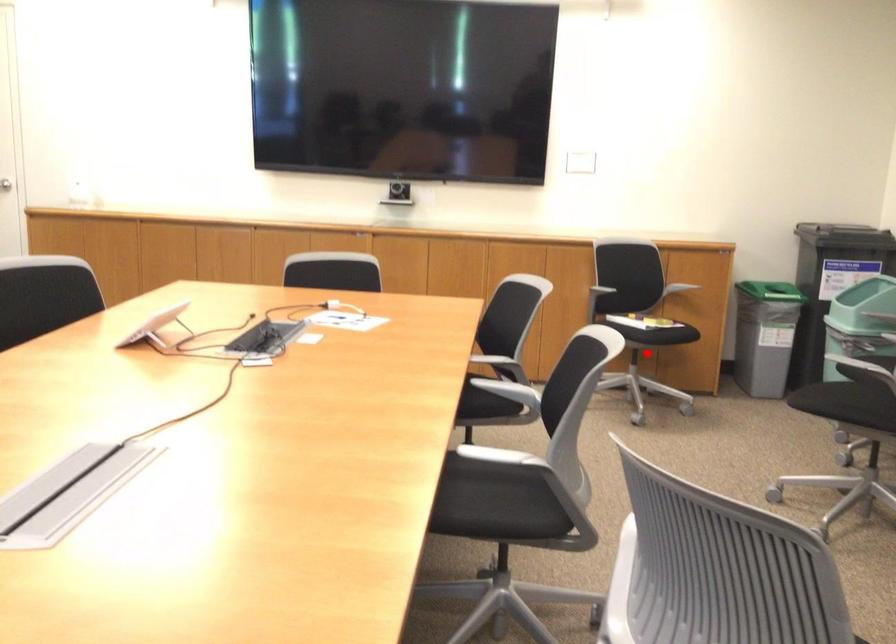
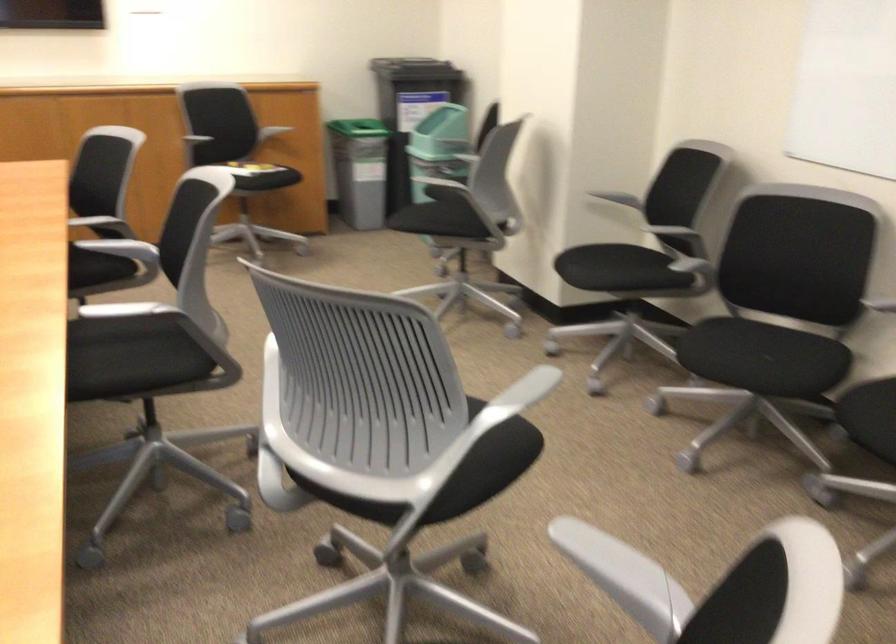
Question: I am providing you with two images of the same scene from different viewpoints. A red point is marked on the first image. Is the red point's position out of view in image 2?

Choices:
 (A) Yes
 (B) No

Answer: (A)